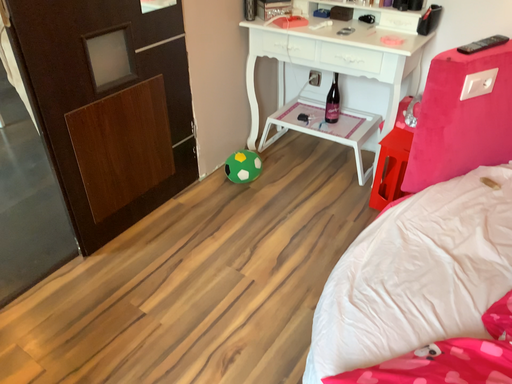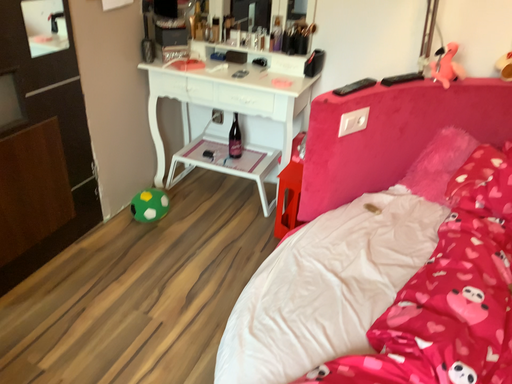
Question: Which way did the camera rotate in the video?

Choices:
 (A) rotated right
 (B) rotated left

Answer: (A)